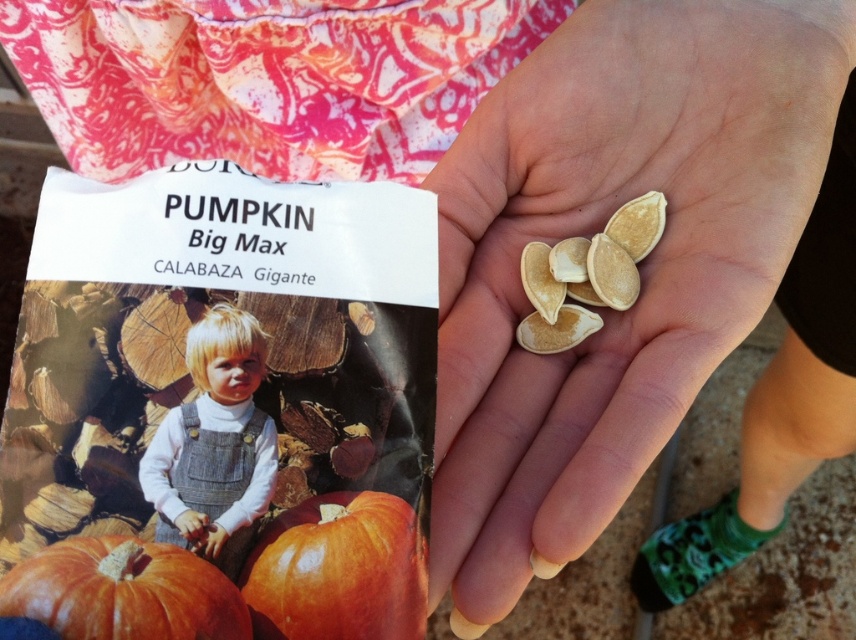
Is smooth beige seeds at center bigger than light brown denim overalls at center?

Correct, smooth beige seeds at center is larger in size than light brown denim overalls at center.

Is point (773, 202) positioned before point (170, 502)?

No, (773, 202) is behind (170, 502).

Does point (527, 131) come behind point (207, 392)?

Yes, point (527, 131) is farther from viewer.

Locate an element on the screen. This screenshot has height=640, width=856. smooth beige seeds at center is located at coordinates (642, 268).

From the picture: Is light brown denim overalls at center closer to the viewer compared to white matte pumpkin seeds at center?

Yes, it is in front of white matte pumpkin seeds at center.

Which is behind, point (235, 522) or point (525, 330)?

The point (525, 330) is more distant.

Locate an element on the screen. light brown denim overalls at center is located at coordinates (214, 444).

The height and width of the screenshot is (640, 856). What do you see at coordinates (214, 444) in the screenshot?
I see `light brown denim overalls at center` at bounding box center [214, 444].

Is point (188, 454) positioned behind point (134, 614)?

Yes, point (188, 454) is farther from viewer.

Find the location of `light brown denim overalls at center`. light brown denim overalls at center is located at coordinates (214, 444).